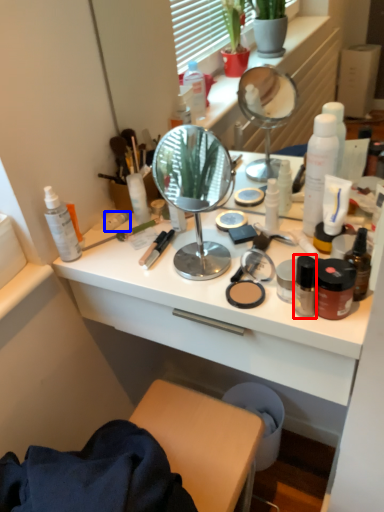
Question: Which of the following is the closest to the observer, toiletry (highlighted by a red box) or toiletry (highlighted by a blue box)?

Choices:
 (A) toiletry
 (B) toiletry

Answer: (A)